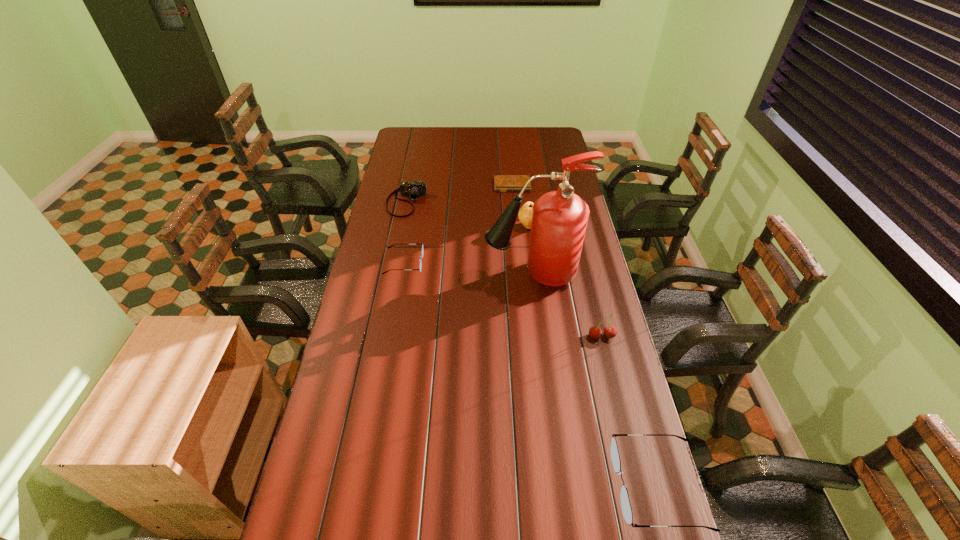
Image resolution: width=960 pixels, height=540 pixels. What are the coordinates of `free region at the near left corner of the desktop` in the screenshot? It's located at (351, 502).

You are a GUI agent. You are given a task and a screenshot of the screen. Output one action in this format:
    pyautogui.click(x=<x>, y=<y>)
    Task: Click on the free space between the shorter spectacles and the camera
    This screenshot has width=960, height=540.
    Given the screenshot: What is the action you would take?
    point(405,233)

Find the location of `free space between the nearest object and the second shortest object`. free space between the nearest object and the second shortest object is located at coordinates (531, 374).

The image size is (960, 540). I want to click on free space between the nearer spectacles and the diary, so click(x=585, y=335).

Identify the location of free point between the sixth farthest object and the tallest object. (566, 306).

Where is `free spot between the camera and the diary`? free spot between the camera and the diary is located at coordinates pos(460,194).

What are the coordinates of `free space between the diary and the camera` in the screenshot? It's located at (460, 194).

At what (x,y) coordinates should I click in order to perform the action: click on vacant region between the diary and the camera. Please return your answer as a coordinate pair (x, y). The width and height of the screenshot is (960, 540). Looking at the image, I should click on (460, 194).

Identify the location of free space that is in between the right spectacles and the third farthest object. (593, 356).

The height and width of the screenshot is (540, 960). Identify the location of object that can be found as the fourth closest to the cherry. (422, 251).